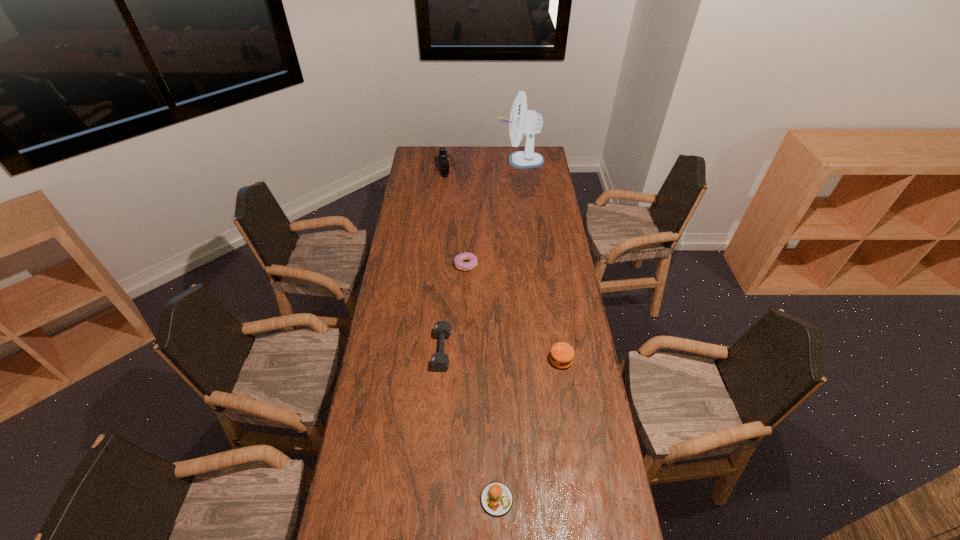
I want to click on vacant space that satisfies the following two spatial constraints: 1. on the grille of the farther patty; 2. on the right side of the fan, so click(543, 360).